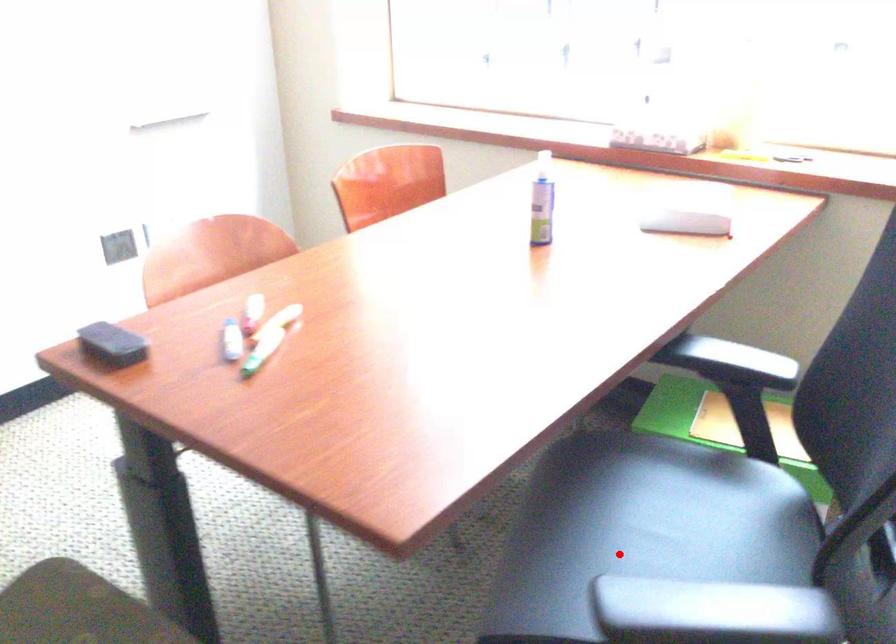
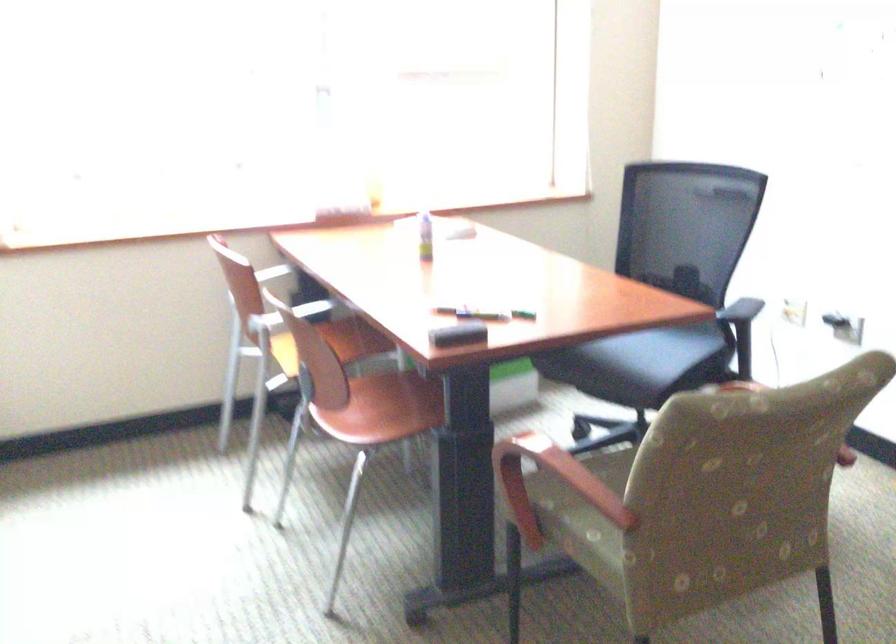
Question: I am providing you with two images of the same scene from different viewpoints. A red point is marked on the first image. Can you still see the location of the red point in image 2?

Choices:
 (A) Yes
 (B) No

Answer: (A)